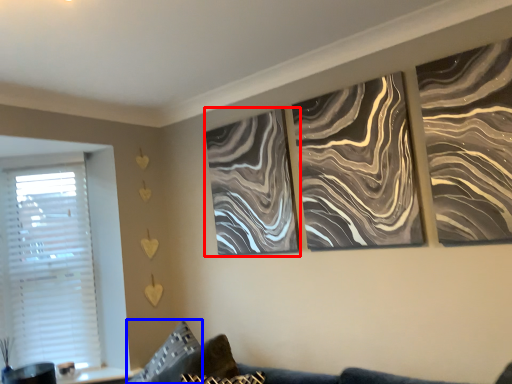
Question: Among these objects, which one is nearest to the camera, canvas (highlighted by a red box) or pillow (highlighted by a blue box)?

Choices:
 (A) canvas
 (B) pillow

Answer: (B)